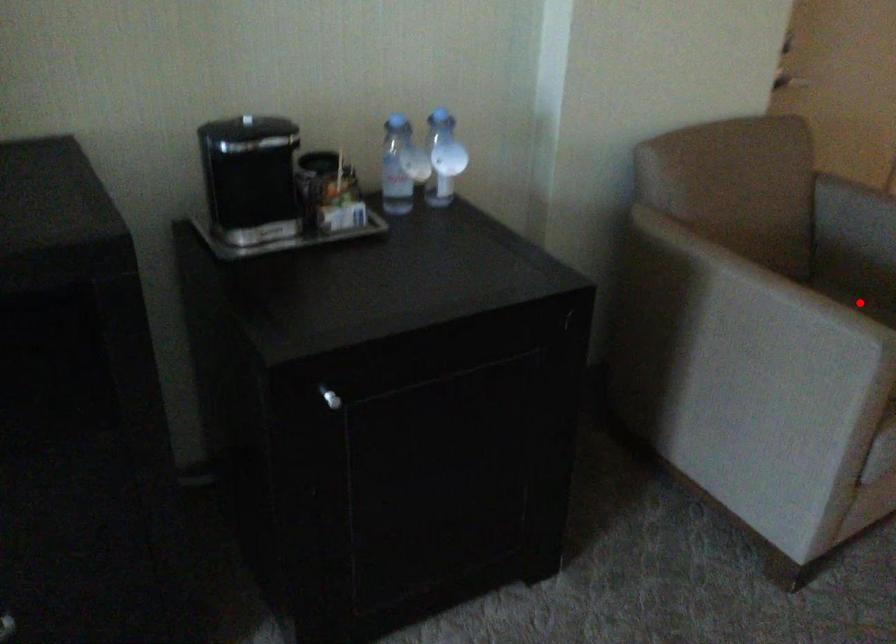
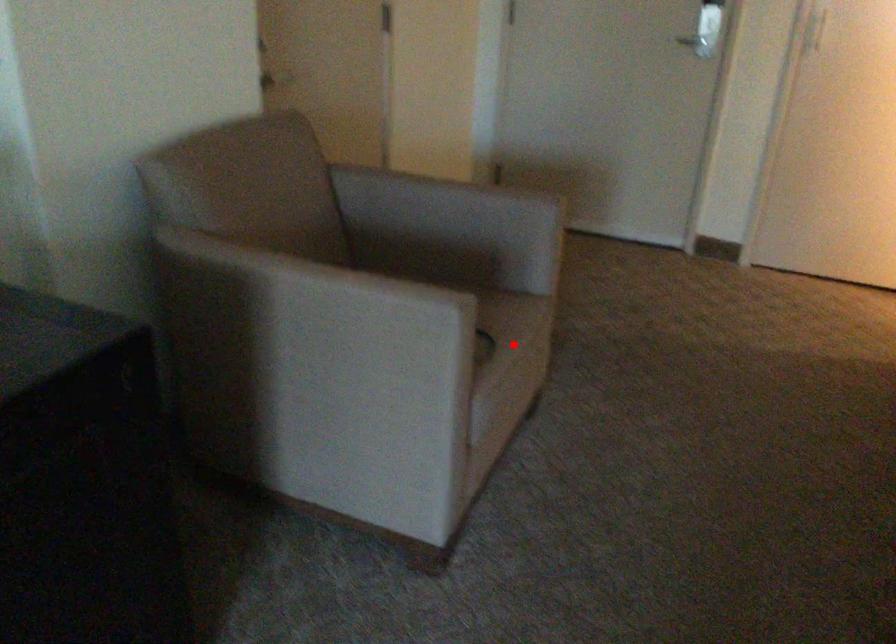
I am providing you with two images of the same scene from different viewpoints. A red point is marked on the first image and another point is marked on the second image. Does the point marked in image1 correspond to the same location as the one in image2?

No